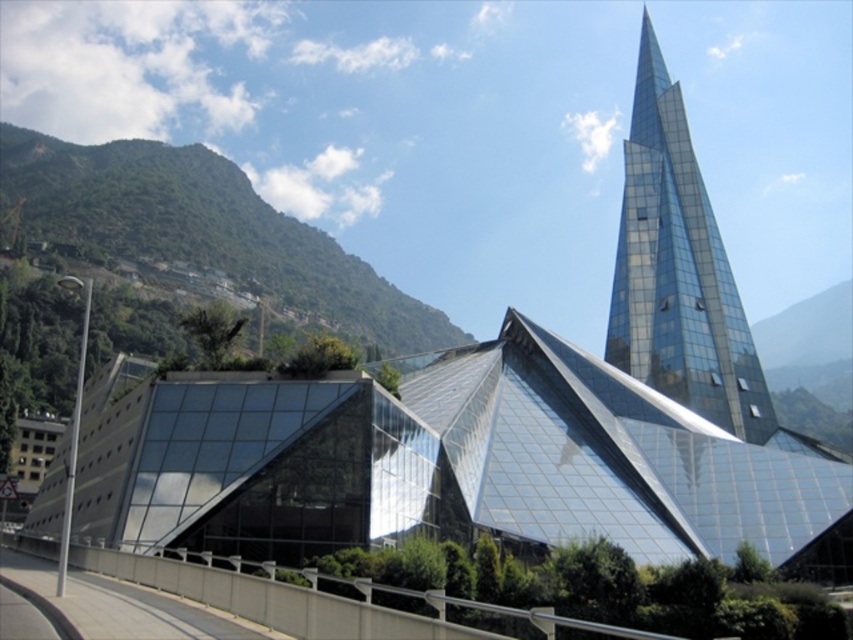
Based on the photo, you are an architect evaluating the design of the transparent glass building at center and the transparent glass spire at upper right. Which of the two structures has a greater width?

The transparent glass building at center has a greater width than the transparent glass spire at upper right.

You are an architect analyzing the building layout. Which structure is taller between the transparent glass building at center and the transparent glass spire at upper right?

The transparent glass spire at upper right is taller than the transparent glass building at center.

You are a drone operator who needs to fly a drone from the transparent glass building at center to the transparent glass spire at upper right. The drone has a maximum flight range of 35 meters. Based on the scene, can the drone safely reach the spire without needing to recharge?

The distance between the transparent glass building at center and the transparent glass spire at upper right is 38.53 meters, which exceeds the drone operator mentioned 35 meters maximum flight range. Therefore, the drone cannot safely reach the spire without needing to recharge.